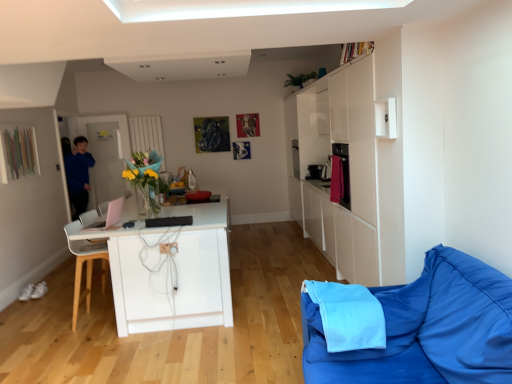
This screenshot has width=512, height=384. I want to click on pink plastic laptop at center, acting as the second appliance starting from the right, so click(x=106, y=217).

Locate an element on the screen. The height and width of the screenshot is (384, 512). black matte speaker at center, which is the 1th appliance from front to back is located at coordinates (169, 221).

Describe the element at coordinates (169, 221) in the screenshot. This screenshot has width=512, height=384. I see `black matte speaker at center, which is the 1th appliance from front to back` at that location.

I want to click on white wooden chair at left, so click(86, 266).

In the scene shown: Considering the positions of objects blue fabric at lower right and pink plastic laptop at center, the 1th appliance when ordered from left to right, in the image provided, who is in front, blue fabric at lower right or pink plastic laptop at center, the 1th appliance when ordered from left to right,?

blue fabric at lower right is more forward.

Is blue fabric at lower right smaller than pink plastic laptop at center, the 1th appliance when ordered from back to front?

No.

Would you consider blue fabric at lower right to be distant from pink plastic laptop at center, acting as the second appliance starting from the right?

Yes, blue fabric at lower right and pink plastic laptop at center, acting as the second appliance starting from the right, are located far from each other.

Between blue fabric at lower right and white wooden chair at left, which one appears on the left side from the viewer's perspective?

white wooden chair at left is more to the left.

Is blue fabric at lower right inside the boundaries of white wooden chair at left, or outside?

blue fabric at lower right is not inside white wooden chair at left, it's outside.

Considering the sizes of objects blue fabric at lower right and white wooden chair at left in the image provided, who is taller, blue fabric at lower right or white wooden chair at left?

Standing taller between the two is white wooden chair at left.

Is blue fabric at lower right bigger than white wooden chair at left?

Incorrect, blue fabric at lower right is not larger than white wooden chair at left.

From a real-world perspective, is pink plastic laptop at center, the 1th appliance when ordered from back to front, on top of white wooden chair at left?

Yes, from a real-world perspective, pink plastic laptop at center, the 1th appliance when ordered from back to front, is above white wooden chair at left.

Considering the relative sizes of pink plastic laptop at center, the 1th appliance when ordered from back to front, and white wooden chair at left in the image provided, is pink plastic laptop at center, the 1th appliance when ordered from back to front, wider than white wooden chair at left?

No.

Relative to white wooden chair at left, is pink plastic laptop at center, the 1th appliance when ordered from back to front, in front or behind?

pink plastic laptop at center, the 1th appliance when ordered from back to front, is positioned closer to the viewer than white wooden chair at left.

Between point (114, 209) and point (103, 282), which one is positioned behind?

The point (103, 282) is more distant.

Does pink plastic laptop at center, the 1th appliance when ordered from back to front, appear on the right side of blue fabric at lower right?

No, pink plastic laptop at center, the 1th appliance when ordered from back to front, is not to the right of blue fabric at lower right.

Is pink plastic laptop at center, the 1th appliance when ordered from back to front, next to blue fabric at lower right and touching it?

pink plastic laptop at center, the 1th appliance when ordered from back to front, and blue fabric at lower right are clearly separated.

From the image's perspective, which is below, pink plastic laptop at center, placed as the second appliance when sorted from front to back, or blue fabric at lower right?

blue fabric at lower right, from the image's perspective.

From a real-world perspective, relative to blue fabric at lower right, is pink plastic laptop at center, acting as the second appliance starting from the right, vertically above or below?

From a real-world perspective, pink plastic laptop at center, acting as the second appliance starting from the right, is physically above blue fabric at lower right.

Between white wooden chair at left and blue fabric couch at lower right, which one has larger size?

Bigger between the two is blue fabric couch at lower right.

From the image's perspective, is white wooden chair at left over blue fabric couch at lower right?

Correct, white wooden chair at left appears higher than blue fabric couch at lower right in the image.

Considering the relative sizes of white wooden chair at left and blue fabric couch at lower right in the image provided, is white wooden chair at left taller than blue fabric couch at lower right?

Correct, white wooden chair at left is much taller as blue fabric couch at lower right.

Is blue fabric couch at lower right oriented away from white wooden chair at left?

No, blue fabric couch at lower right is not facing away from white wooden chair at left.

At what (x,y) coordinates should I click in order to perform the action: click on chair behind the blue fabric couch at lower right. Please return your answer as a coordinate pair (x, y). Looking at the image, I should click on (86, 266).

Can you tell me how much blue fabric couch at lower right and white wooden chair at left differ in facing direction?

The angular difference between blue fabric couch at lower right and white wooden chair at left is 179 degrees.

Where is `chair that appears behind the black matte speaker at center, the first appliance in the right-to-left sequence`? chair that appears behind the black matte speaker at center, the first appliance in the right-to-left sequence is located at coordinates (86, 266).

Consider the image. Is white wooden chair at left surrounded by black matte speaker at center, which is the 1th appliance from front to back?

No, white wooden chair at left is not a part of black matte speaker at center, which is the 1th appliance from front to back.

Is point (188, 220) closer to viewer compared to point (88, 263)?

Yes, it is.

Locate an element on the screen. This screenshot has width=512, height=384. material that appears below the pink plastic laptop at center, the 1th appliance when ordered from left to right (from a real-world perspective) is located at coordinates (348, 315).

At what (x,y) coordinates should I click in order to perform the action: click on material above the white wooden chair at left (from the image's perspective). Please return your answer as a coordinate pair (x, y). The height and width of the screenshot is (384, 512). Looking at the image, I should click on (348, 315).

Based on their spatial positions, is blue fabric couch at lower right or black matte speaker at center, the 2th appliance when ordered from back to front, further from white wooden chair at left?

blue fabric couch at lower right is positioned further to the anchor white wooden chair at left.

Based on their spatial positions, is pink plastic laptop at center, the 1th appliance when ordered from back to front, or blue fabric at lower right further from blue fabric couch at lower right?

pink plastic laptop at center, the 1th appliance when ordered from back to front.

Considering their positions, is white wooden chair at left positioned closer to blue fabric at lower right than black matte speaker at center, which is the 2th appliance from left to right?

Based on the image, black matte speaker at center, which is the 2th appliance from left to right, appears to be nearer to blue fabric at lower right.

From the image, which object appears to be farther from blue fabric at lower right, blue fabric couch at lower right or black matte speaker at center, the 2th appliance when ordered from back to front?

black matte speaker at center, the 2th appliance when ordered from back to front, is further to blue fabric at lower right.

Estimate the real-world distances between objects in this image. Which object is closer to blue fabric couch at lower right, pink plastic laptop at center, the 1th appliance when ordered from back to front, or black matte speaker at center, which is the 1th appliance from front to back?

black matte speaker at center, which is the 1th appliance from front to back, lies closer to blue fabric couch at lower right than the other object.

When comparing their distances from white wooden chair at left, does blue fabric couch at lower right or pink plastic laptop at center, the 1th appliance when ordered from left to right, seem further?

Among the two, blue fabric couch at lower right is located further to white wooden chair at left.

Based on their spatial positions, is blue fabric couch at lower right or black matte speaker at center, the first appliance in the right-to-left sequence, further from pink plastic laptop at center, the 1th appliance when ordered from back to front?

blue fabric couch at lower right lies further to pink plastic laptop at center, the 1th appliance when ordered from back to front, than the other object.

When comparing their distances from blue fabric couch at lower right, does white wooden chair at left or pink plastic laptop at center, the 1th appliance when ordered from back to front, seem closer?

white wooden chair at left.

Locate an element on the screen. Image resolution: width=512 pixels, height=384 pixels. material located between blue fabric couch at lower right and pink plastic laptop at center, acting as the second appliance starting from the right, in the depth direction is located at coordinates (348, 315).

This screenshot has height=384, width=512. I want to click on material between blue fabric couch at lower right and white wooden chair at left along the z-axis, so click(348, 315).

Where is `material between blue fabric couch at lower right and black matte speaker at center, which is the 2th appliance from left to right, along the z-axis`? material between blue fabric couch at lower right and black matte speaker at center, which is the 2th appliance from left to right, along the z-axis is located at coordinates (348, 315).

Find the location of `appliance between white wooden chair at left and black matte speaker at center, which is the 2th appliance from left to right, in the horizontal direction`. appliance between white wooden chair at left and black matte speaker at center, which is the 2th appliance from left to right, in the horizontal direction is located at coordinates (106, 217).